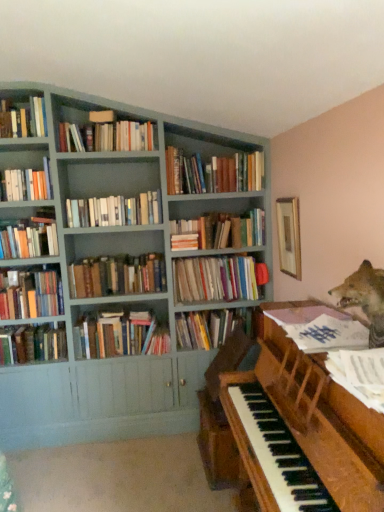
Question: Does hardcover books at left, which appears as the 7th book when viewed from the top, appear on the left side of hardcover books at left, arranged as the tenth book when viewed from the top?

Choices:
 (A) yes
 (B) no

Answer: (A)

Question: From the image's perspective, is hardcover books at left, arranged as the 9th book when ordered from the bottom, beneath hardcover books at left, arranged as the tenth book when viewed from the top?

Choices:
 (A) yes
 (B) no

Answer: (B)

Question: Is hardcover books at left, arranged as the 9th book when ordered from the bottom, oriented away from hardcover books at left, which appears as the 6th book when ordered from the bottom?

Choices:
 (A) yes
 (B) no

Answer: (B)

Question: Is there a large distance between hardcover books at left, which appears as the 7th book when viewed from the top, and hardcover books at left, which appears as the 6th book when ordered from the bottom?

Choices:
 (A) yes
 (B) no

Answer: (B)

Question: Can you confirm if hardcover books at left, arranged as the 9th book when ordered from the bottom, is smaller than hardcover books at left, which appears as the 6th book when ordered from the bottom?

Choices:
 (A) no
 (B) yes

Answer: (A)

Question: In terms of size, does hardcover books at upper center, marked as the 14th book in a bottom-to-top arrangement, appear bigger or smaller than hardcover books at left, positioned as the fifteenth book in top-to-bottom order?

Choices:
 (A) small
 (B) big

Answer: (B)

Question: Is hardcover books at upper center, marked as the 14th book in a bottom-to-top arrangement, in front of or behind hardcover books at left, which ranks as the first book in bottom-to-top order, in the image?

Choices:
 (A) front
 (B) behind

Answer: (A)

Question: From a real-world perspective, is hardcover books at upper center, marked as the 14th book in a bottom-to-top arrangement, physically located above or below hardcover books at left, which ranks as the first book in bottom-to-top order?

Choices:
 (A) below
 (B) above

Answer: (B)

Question: From the image's perspective, is hardcover books at upper center, the second book from the top, located above or below hardcover books at left, which ranks as the first book in bottom-to-top order?

Choices:
 (A) above
 (B) below

Answer: (A)

Question: Based on their sizes in the image, would you say hardcover books at left, arranged as the tenth book when viewed from the top, is bigger or smaller than hardcover book at center, marked as the 13th book in a top-to-bottom arrangement?

Choices:
 (A) small
 (B) big

Answer: (A)

Question: Is hardcover books at left, arranged as the tenth book when viewed from the top, inside or outside of hardcover book at center, the third book positioned from the bottom?

Choices:
 (A) inside
 (B) outside

Answer: (B)

Question: Is hardcover books at left, arranged as the tenth book when viewed from the top, taller or shorter than hardcover book at center, marked as the 13th book in a top-to-bottom arrangement?

Choices:
 (A) tall
 (B) short

Answer: (A)

Question: Is hardcover books at left, which appears as the 6th book when ordered from the bottom, wider or thinner than hardcover book at center, marked as the 13th book in a top-to-bottom arrangement?

Choices:
 (A) wide
 (B) thin

Answer: (B)

Question: Visually, is hardcover books at center, the fifth book in the top-to-bottom sequence, positioned to the left or to the right of white paper music at right, which is counted as the fifth book, starting from the bottom?

Choices:
 (A) right
 (B) left

Answer: (B)

Question: Considering the positions of hardcover books at center, the fifth book in the top-to-bottom sequence, and white paper music at right, which is counted as the fifth book, starting from the bottom, in the image, is hardcover books at center, the fifth book in the top-to-bottom sequence, taller or shorter than white paper music at right, which is counted as the fifth book, starting from the bottom,?

Choices:
 (A) tall
 (B) short

Answer: (A)